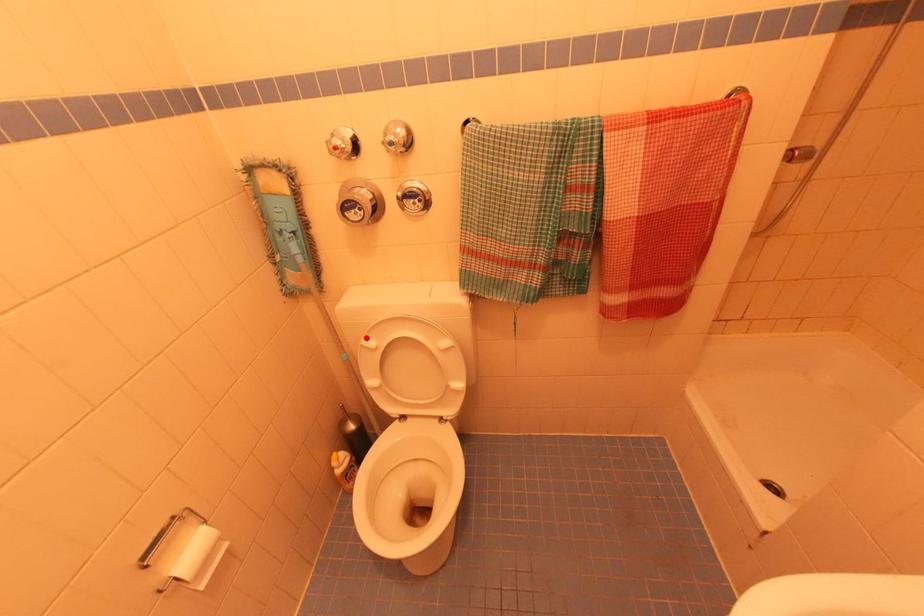
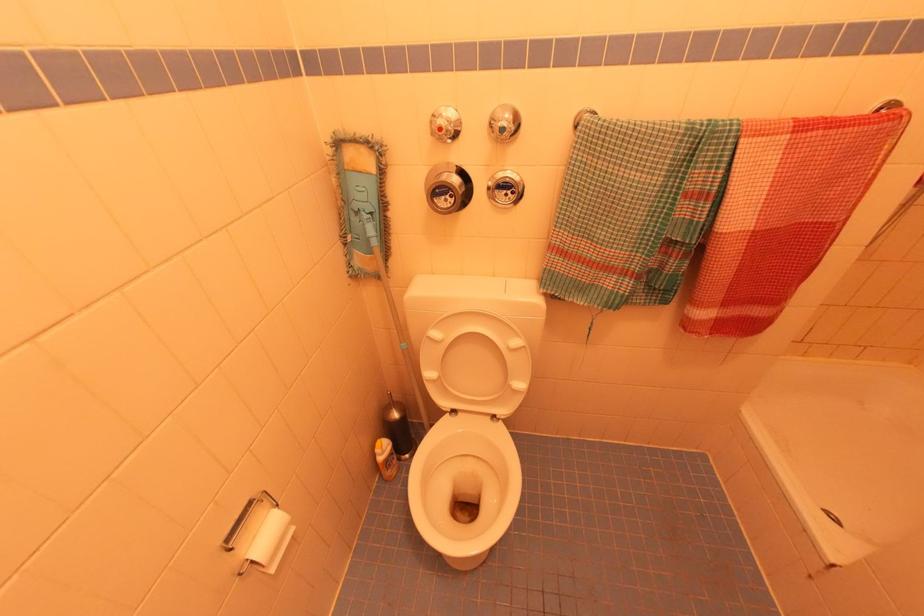
Question: I am providing you with two images of the same scene from different viewpoints. A red point is marked on the first image. Is the red point's position out of view in image 2?

Choices:
 (A) Yes
 (B) No

Answer: (B)